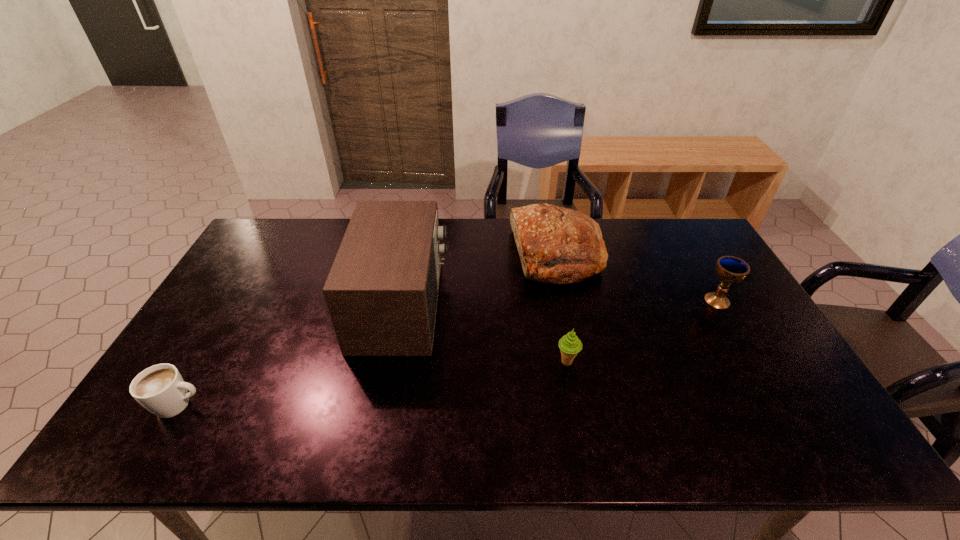
This screenshot has width=960, height=540. Find the location of `vacant area situated at the sliced front of the fourth shortest object`. vacant area situated at the sliced front of the fourth shortest object is located at coordinates (405, 256).

Find the location of `vacant region located on the back of the chalice`. vacant region located on the back of the chalice is located at coordinates (696, 264).

You are a GUI agent. You are given a task and a screenshot of the screen. Output one action in this format:
    pyautogui.click(x=<x>, y=<y>)
    Task: Click on the vacant area located 0.060m on the right of the icecream
    The image size is (960, 540).
    Given the screenshot: What is the action you would take?
    pyautogui.click(x=602, y=362)

Where is `free space located with the handle on the side of the cappuccino`? free space located with the handle on the side of the cappuccino is located at coordinates (242, 405).

Identify the location of object that is at the far edge. (558, 245).

Locate an element on the screen. object that is positioned at the near edge is located at coordinates (160, 389).

Where is `object at the left edge`? The image size is (960, 540). object at the left edge is located at coordinates (160, 389).

Identify the location of object present at the right edge. (729, 269).

Where is `object present at the near left corner`? This screenshot has height=540, width=960. object present at the near left corner is located at coordinates (160, 389).

Find the location of a particular element. vacant area at the far edge is located at coordinates (453, 245).